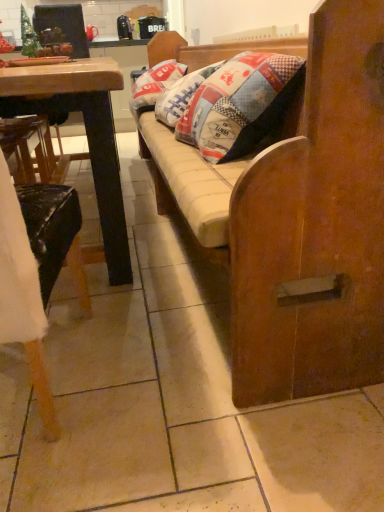
This screenshot has height=512, width=384. Find the location of `unoccupied area behind wooden chair at left`. unoccupied area behind wooden chair at left is located at coordinates (x=121, y=306).